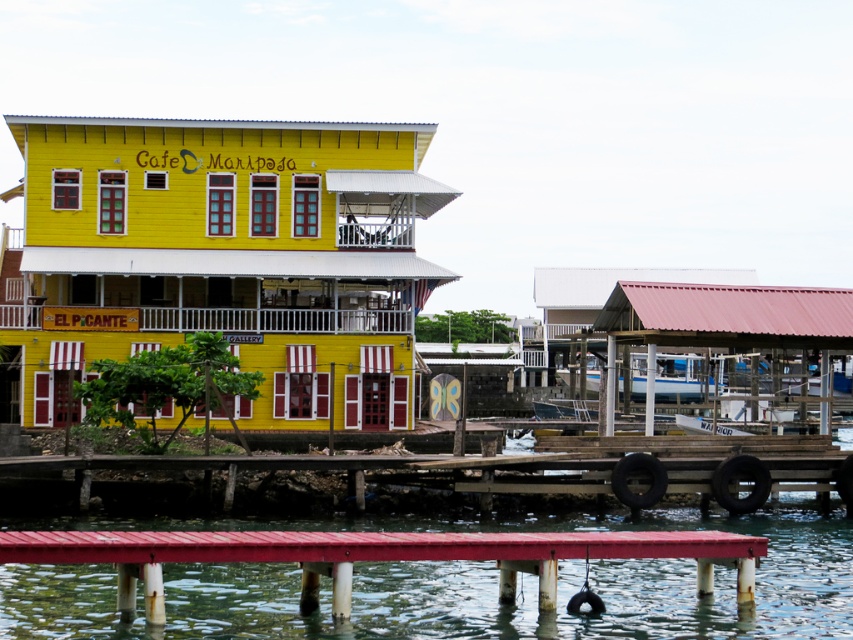
You are a tourist standing on the wooden pier and want to take a photo of the white glossy boat at center and the smooth water at lower center. Which object should you focus on first if you want to capture both in a single frame without moving your camera?

You should focus on the white glossy boat at center first because the smooth water at lower center is located below it, so by centering the boat in your frame, you can ensure the water is naturally included below without needing to adjust your camera position.

You are standing at the entrance of Cafe Mariposa and want to reach the smooth water at lower center. According to the image, which direction should you walk to get there?

The smooth water at lower center is located at point (456, 586), so you should walk towards the lower center direction to reach it.

You are a photographer planning to capture the entire white glossy boat at center and smooth water at lower center in a single frame. Given that your camera has a fixed focal length, which object should you position closer to the center of the frame to ensure both are fully visible?

The smooth water at lower center has a greater width than the white glossy boat at center. To ensure both are fully visible in the frame, position the smooth water at lower center closer to the center of the frame since its larger size requires more space.